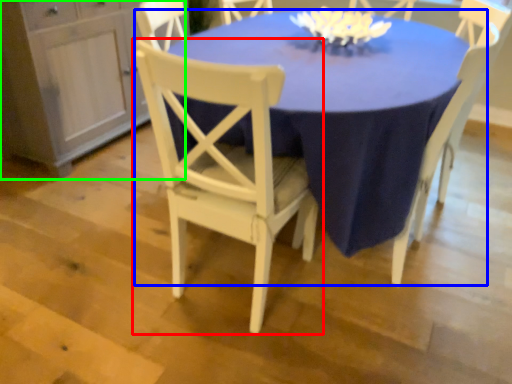
Question: Which is nearer to the chair (highlighted by a red box)? table (highlighted by a blue box) or dresser (highlighted by a green box).

Choices:
 (A) table
 (B) dresser

Answer: (A)